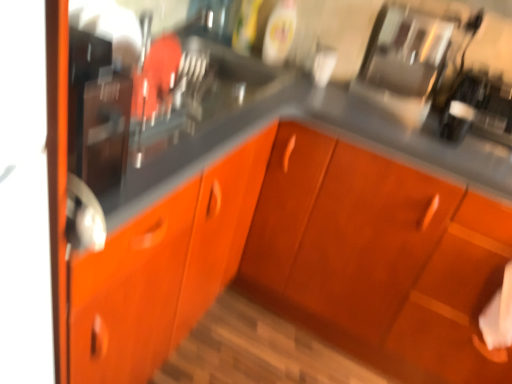
Measure the distance between glossy stainless steel coffee maker at upper right and camera.

glossy stainless steel coffee maker at upper right is 1.45 meters away from camera.

I want to click on glossy stainless steel coffee maker at upper right, so click(x=405, y=61).

Where is `cabinetry below the glossy stainless steel coffee maker at upper right (from a real-world perspective)`? This screenshot has height=384, width=512. cabinetry below the glossy stainless steel coffee maker at upper right (from a real-world perspective) is located at coordinates (301, 262).

Based on their positions, is glossy stainless steel coffee maker at upper right located to the left or right of orange matte cabinet at center?

glossy stainless steel coffee maker at upper right is to the right of orange matte cabinet at center.

Which of these two, glossy stainless steel coffee maker at upper right or orange matte cabinet at center, is bigger?

With larger size is orange matte cabinet at center.

Are glossy stainless steel coffee maker at upper right and orange matte cabinet at center beside each other?

No, glossy stainless steel coffee maker at upper right is not beside orange matte cabinet at center.

Is matte black sink at left oriented towards glossy stainless steel coffee maker at upper right?

No, matte black sink at left is not turned towards glossy stainless steel coffee maker at upper right.

Which object is thinner, matte black sink at left or glossy stainless steel coffee maker at upper right?

matte black sink at left.

From a real-world perspective, which object rests below the other?

In real-world perspective, glossy stainless steel coffee maker at upper right is lower.

Consider the image. Can you confirm if glossy stainless steel coffee maker at upper right is taller than matte black sink at left?

No.

Is glossy stainless steel coffee maker at upper right facing away from matte black sink at left?

No, glossy stainless steel coffee maker at upper right's orientation is not away from matte black sink at left.

Can you confirm if glossy stainless steel coffee maker at upper right is smaller than matte black sink at left?

No, glossy stainless steel coffee maker at upper right is not smaller than matte black sink at left.

Does glossy stainless steel coffee maker at upper right have a lesser width compared to matte black sink at left?

No.

Is orange matte cabinet at center positioned far away from glossy stainless steel coffee maker at upper right?

They are positioned close to each other.

From their relative heights in the image, would you say orange matte cabinet at center is taller or shorter than glossy stainless steel coffee maker at upper right?

Considering their sizes, orange matte cabinet at center has more height than glossy stainless steel coffee maker at upper right.

Is orange matte cabinet at center inside or outside of glossy stainless steel coffee maker at upper right?

The correct answer is: outside.

Considering the sizes of matte black sink at left and orange matte cabinet at center in the image, is matte black sink at left wider or thinner than orange matte cabinet at center?

Result: Clearly, matte black sink at left has less width compared to orange matte cabinet at center.

Is matte black sink at left beside orange matte cabinet at center?

No.

From the picture: Considering the relative positions of matte black sink at left and orange matte cabinet at center in the image provided, is matte black sink at left to the left or to the right of orange matte cabinet at center?

From the image, it's evident that matte black sink at left is to the left of orange matte cabinet at center.

Considering the sizes of matte black sink at left and orange matte cabinet at center in the image, is matte black sink at left taller or shorter than orange matte cabinet at center?

Clearly, matte black sink at left is shorter compared to orange matte cabinet at center.

Based on the photo, which is farther, (149, 241) or (135, 87)?

Positioned behind is point (135, 87).

Is orange matte cabinet at center oriented towards matte black sink at left?

No, orange matte cabinet at center does not turn towards matte black sink at left.

Is the position of orange matte cabinet at center more distant than that of matte black sink at left?

That is False.

Find the location of a particular element. cabinetry in front of the glossy stainless steel coffee maker at upper right is located at coordinates (301, 262).

This screenshot has width=512, height=384. In order to click on sink lying on the left of glossy stainless steel coffee maker at upper right in this screenshot , I will do (x=158, y=104).

Based on their spatial positions, is orange matte cabinet at center or matte black sink at left further from glossy stainless steel coffee maker at upper right?

Based on the image, orange matte cabinet at center appears to be further to glossy stainless steel coffee maker at upper right.

Estimate the real-world distances between objects in this image. Which object is further from matte black sink at left, orange matte cabinet at center or glossy stainless steel coffee maker at upper right?

glossy stainless steel coffee maker at upper right lies further to matte black sink at left than the other object.

Consider the image. Looking at the image, which one is located further to orange matte cabinet at center, glossy stainless steel coffee maker at upper right or matte black sink at left?

Based on the image, glossy stainless steel coffee maker at upper right appears to be further to orange matte cabinet at center.

Based on their spatial positions, is matte black sink at left or orange matte cabinet at center closer to glossy stainless steel coffee maker at upper right?

matte black sink at left.

Which object lies nearer to the anchor point orange matte cabinet at center, matte black sink at left or glossy stainless steel coffee maker at upper right?

matte black sink at left is positioned closer to the anchor orange matte cabinet at center.

Considering their positions, is glossy stainless steel coffee maker at upper right positioned further to matte black sink at left than orange matte cabinet at center?

The object further to matte black sink at left is glossy stainless steel coffee maker at upper right.

Where is `sink between orange matte cabinet at center and glossy stainless steel coffee maker at upper right along the z-axis`? sink between orange matte cabinet at center and glossy stainless steel coffee maker at upper right along the z-axis is located at coordinates (158, 104).